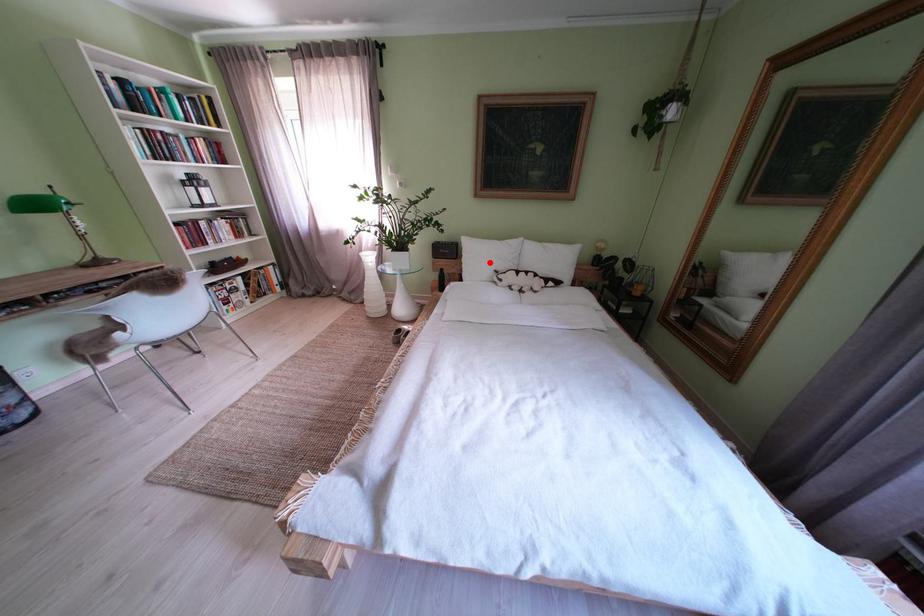
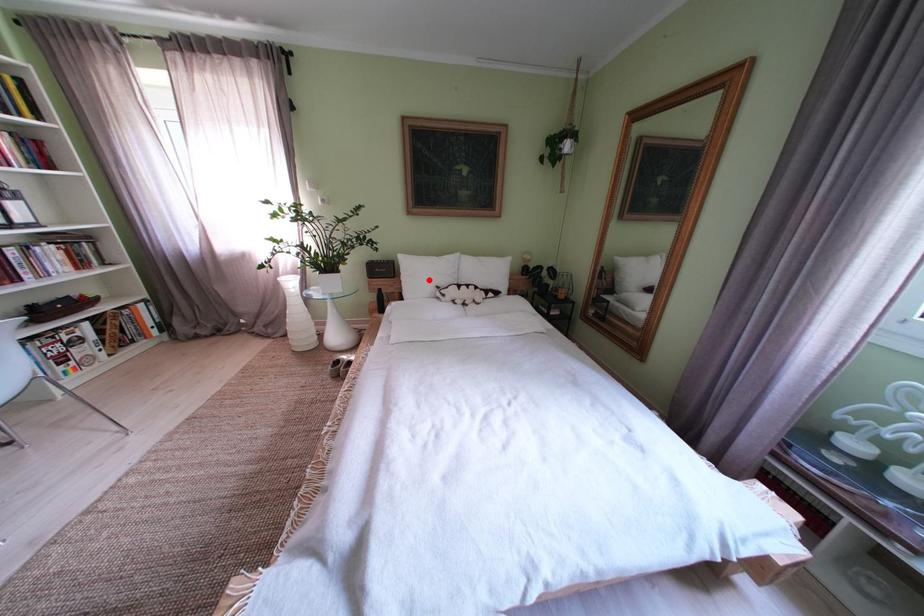
I am providing you with two images of the same scene from different viewpoints. A red point is marked on the first image and another point is marked on the second image. Is the marked point in image1 the same physical position as the marked point in image2?

Yes